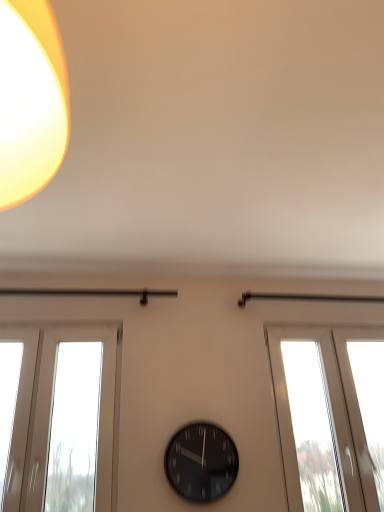
What do you see at coordinates (330, 416) in the screenshot? I see `white glossy window at right` at bounding box center [330, 416].

Measure the distance between point (350, 489) and camera.

The depth of point (350, 489) is 7.44 feet.

Where is `white glossy window at right`? Image resolution: width=384 pixels, height=512 pixels. white glossy window at right is located at coordinates pyautogui.click(x=330, y=416).

Describe the element at coordinates (201, 462) in the screenshot. I see `black glass clock at center` at that location.

You are a GUI agent. You are given a task and a screenshot of the screen. Output one action in this format:
    pyautogui.click(x=<x>, y=<y>)
    Task: Click on the black glass clock at center
    The image size is (384, 512).
    Given the screenshot: What is the action you would take?
    pyautogui.click(x=201, y=462)

This screenshot has height=512, width=384. What are the coordinates of `white glossy window at right` in the screenshot? It's located at (330, 416).

Between black glass clock at center and white glossy window at right, which one appears on the right side from the viewer's perspective?

white glossy window at right is more to the right.

Between black glass clock at center and white glossy window at right, which one is positioned behind?

Positioned behind is white glossy window at right.

Considering the points (203, 500) and (283, 355), which point is in front, point (203, 500) or point (283, 355)?

The point (203, 500) is in front.

From the image's perspective, is black glass clock at center over white glossy window at right?

No, from the image's perspective, black glass clock at center is not on top of white glossy window at right.

From a real-world perspective, is black glass clock at center physically located above or below white glossy window at right?

In terms of real-world spatial position, black glass clock at center is below white glossy window at right.

Which of these two, black glass clock at center or white glossy window at right, is wider?

white glossy window at right is wider.

Does black glass clock at center have a lesser height compared to white glossy window at right?

Correct, black glass clock at center is not as tall as white glossy window at right.

Is black glass clock at center smaller than white glossy window at right?

Correct, black glass clock at center occupies less space than white glossy window at right.

Do you think black glass clock at center is within white glossy window at right, or outside of it?

black glass clock at center is located beyond the bounds of white glossy window at right.

Looking at this image, does black glass clock at center touch white glossy window at right?

No, black glass clock at center is not next to white glossy window at right.

Could you tell me if black glass clock at center is turned towards white glossy window at right?

No, black glass clock at center is not facing towards white glossy window at right.

How much distance is there between black glass clock at center and white glossy window at right?

They are 21.45 inches apart.

Where is `window located above the black glass clock at center (from the image's perspective)`? The width and height of the screenshot is (384, 512). window located above the black glass clock at center (from the image's perspective) is located at coordinates (330, 416).

In the scene shown: Considering the relative positions of white glossy window at right and black glass clock at center in the image provided, is white glossy window at right to the right of black glass clock at center from the viewer's perspective?

Correct, you'll find white glossy window at right to the right of black glass clock at center.

Is white glossy window at right in front of or behind black glass clock at center in the image?

white glossy window at right is behind black glass clock at center.

Considering the positions of point (297, 393) and point (196, 459), is point (297, 393) closer or farther from the camera than point (196, 459)?

Point (297, 393).

From the image's perspective, is white glossy window at right located above or below black glass clock at center?

white glossy window at right is above black glass clock at center.

From a real-world perspective, which is physically below, white glossy window at right or black glass clock at center?

In real-world perspective, black glass clock at center is lower.

Can you confirm if white glossy window at right is thinner than black glass clock at center?

No, white glossy window at right is not thinner than black glass clock at center.

Is white glossy window at right shorter than black glass clock at center?

No.

Can you confirm if white glossy window at right is smaller than black glass clock at center?

No.

Is white glossy window at right situated inside black glass clock at center or outside?

white glossy window at right is outside black glass clock at center.

Is white glossy window at right next to black glass clock at center and touching it?

No, white glossy window at right is not making contact with black glass clock at center.

Based on the photo, is white glossy window at right looking in the opposite direction of black glass clock at center?

No, white glossy window at right is not facing away from black glass clock at center.

How different are the orientations of white glossy window at right and black glass clock at center in degrees?

The angular difference between white glossy window at right and black glass clock at center is 0.0722 degrees.

Find the location of a particular element. The image size is (384, 512). window that is above the black glass clock at center (from the image's perspective) is located at coordinates (330, 416).

What are the coordinates of `window that appears above the black glass clock at center (from a real-world perspective)` in the screenshot? It's located at (330, 416).

The image size is (384, 512). In order to click on window lying behind the black glass clock at center in this screenshot , I will do point(330,416).